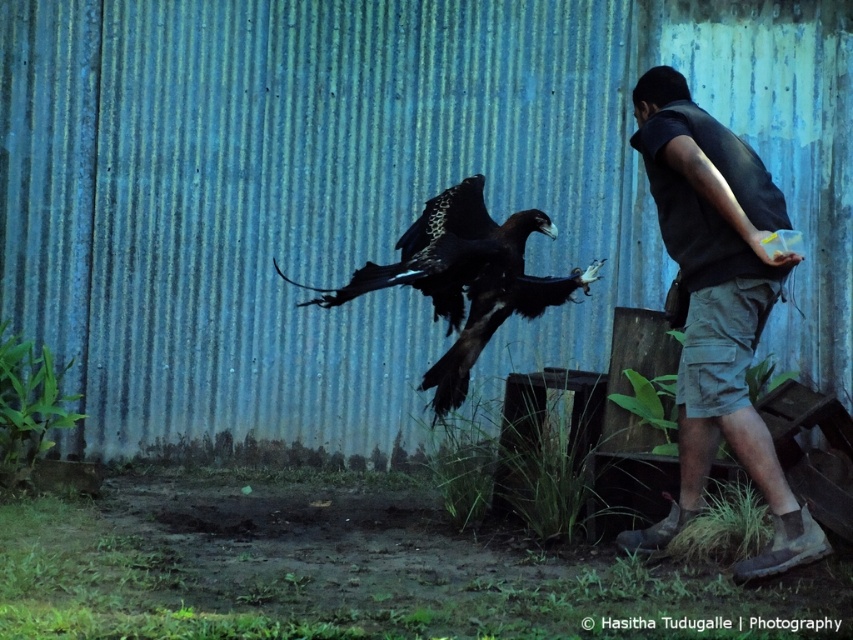
You are a wildlife photographer trying to capture a clear photo of the dark gray vest at right and the dark brown feathers at center. Which object should you focus on first to ensure both are in focus?

You should focus on the dark gray vest at right first because it is closer to the viewer than the dark brown feathers at center, so adjusting focus from near to far will help both be in focus.

You are a photographer trying to capture a clear shot of the dark gray vest at right and the dark brown feathers at center. Which object should you focus on first if you want to ensure both are in focus without moving your camera? Explain your reasoning based on their positions.

The dark gray vest at right is to the right of dark brown feathers at center. Since the dark brown feathers at center are closer to the camera, focusing on them first would ensure the dark gray vest at right also comes into focus as they are aligned along the same focal plane.